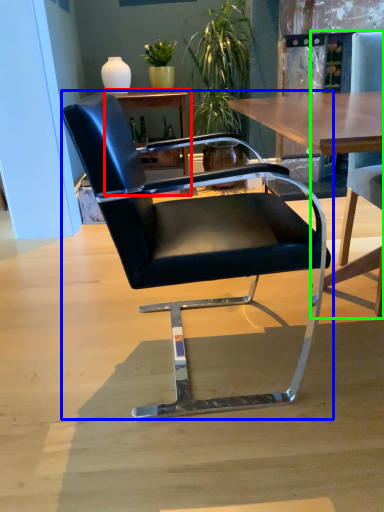
Question: Based on their relative distances, which object is farther from table (highlighted by a red box)? Choose from chair (highlighted by a blue box) and chair (highlighted by a green box).

Choices:
 (A) chair
 (B) chair

Answer: (A)